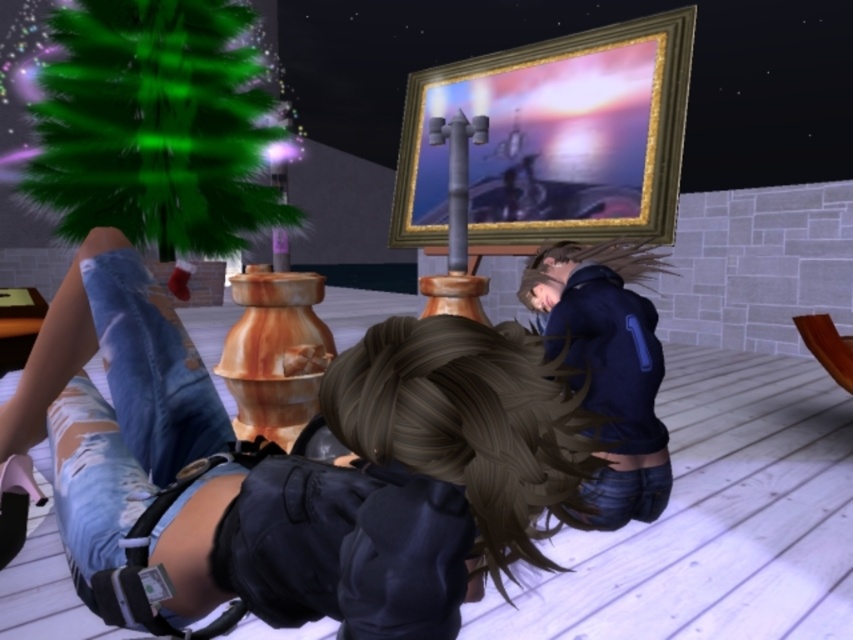
Can you confirm if green furry christmas tree at upper left is positioned to the left of brown matte hair at center?

Indeed, green furry christmas tree at upper left is positioned on the left side of brown matte hair at center.

Does green furry christmas tree at upper left have a greater width compared to brown matte hair at center?

Indeed, green furry christmas tree at upper left has a greater width compared to brown matte hair at center.

The width and height of the screenshot is (853, 640). I want to click on green furry christmas tree at upper left, so click(x=155, y=125).

I want to click on green furry christmas tree at upper left, so click(x=155, y=125).

Describe the element at coordinates (366, 500) in the screenshot. I see `denim shorts at center` at that location.

Is denim shorts at center positioned in front of brown matte hair at center?

Yes, denim shorts at center is in front of brown matte hair at center.

Is point (106, 307) positioned behind point (524, 292)?

No, (106, 307) is closer to viewer.

The width and height of the screenshot is (853, 640). Identify the location of denim shorts at center. (366, 500).

Does point (248, 528) lie in front of point (238, 186)?

That is True.

Consider the image. Does denim shorts at center appear on the right side of green furry christmas tree at upper left?

Correct, you'll find denim shorts at center to the right of green furry christmas tree at upper left.

Where is `denim shorts at center`? denim shorts at center is located at coordinates (366, 500).